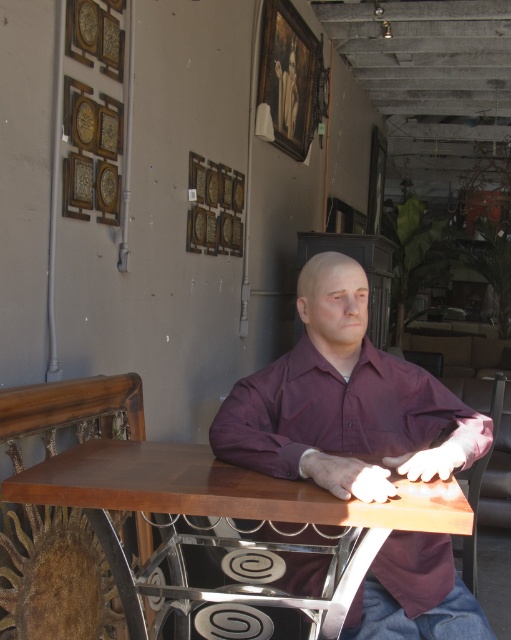
Between point (476, 634) and point (272, 138), which one is positioned behind?

The point (272, 138) is behind.

Is matte purple shirt at center further to the viewer compared to wooden picture frame at upper center?

No.

Which is in front, point (363, 328) or point (312, 70)?

Point (363, 328) is more forward.

Where is `matte purple shirt at center`? The image size is (511, 640). matte purple shirt at center is located at coordinates (344, 401).

Is the position of wooden table at center less distant than that of brown leather chair at lower right?

Yes, wooden table at center is closer to the viewer.

Which is in front, point (188, 488) or point (476, 490)?

Positioned in front is point (188, 488).

Is point (247, 509) positioned before point (464, 550)?

Yes.

At what (x,y) coordinates should I click in order to perform the action: click on wooden table at center. Please return your answer as a coordinate pair (x, y). The height and width of the screenshot is (640, 511). Looking at the image, I should click on (222, 490).

How much distance is there between wooden table at center and wooden textured chair at left?

16.39 inches

Can you confirm if wooden table at center is smaller than wooden textured chair at left?

Yes, wooden table at center is smaller than wooden textured chair at left.

Find the location of a particular element. Image resolution: width=511 pixels, height=640 pixels. wooden table at center is located at coordinates (222, 490).